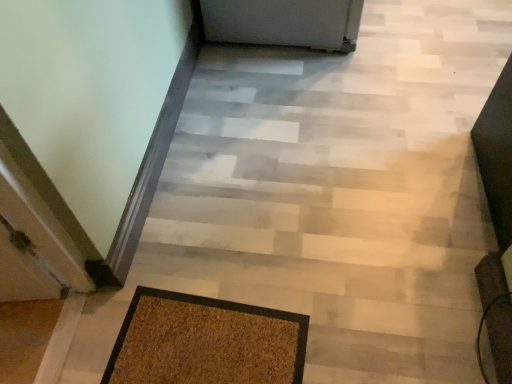
Identify the location of free location above brown textured mat at lower center (from a real-world perspective). (208, 343).